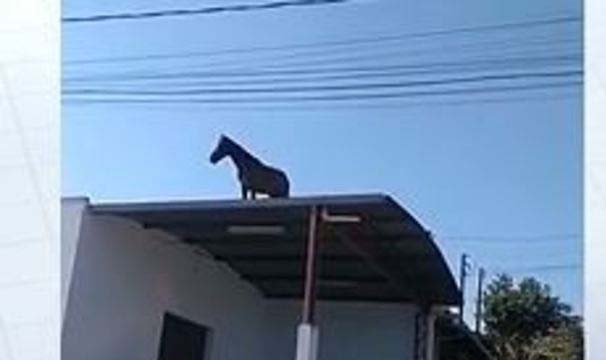
At what (x,y) coordinates should I click in order to perform the action: click on walls. Please return your answer as a coordinate pair (x, y). This screenshot has height=360, width=606. Looking at the image, I should click on (67, 226), (132, 256), (368, 328).